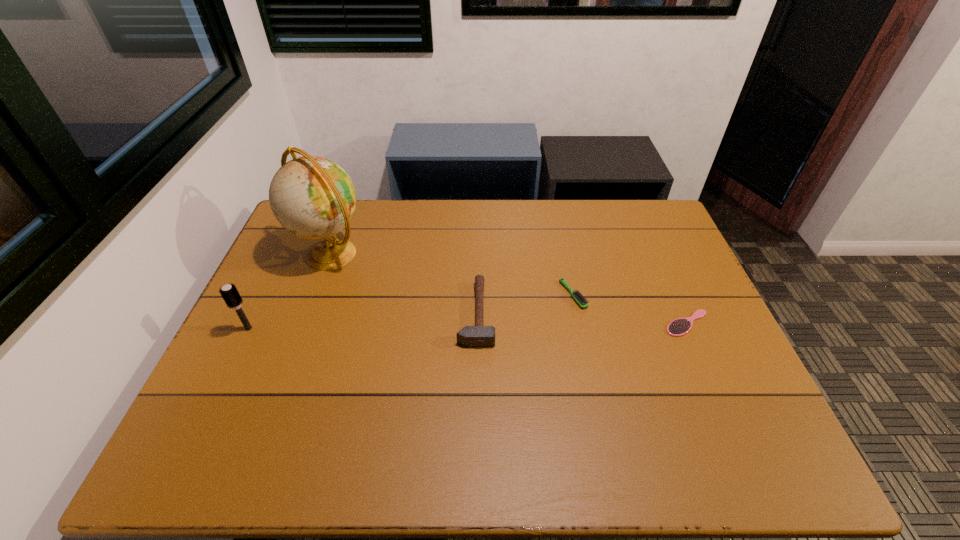
The image size is (960, 540). Find the location of `vacant position in the image that satisfies the following two spatial constraints: 1. on the striking surface of the third object from right to left; 2. on the right side of the rightmost hairbrush`. vacant position in the image that satisfies the following two spatial constraints: 1. on the striking surface of the third object from right to left; 2. on the right side of the rightmost hairbrush is located at coordinates (476, 323).

Identify the location of free location that satisfies the following two spatial constraints: 1. on the back side of the leftmost hairbrush; 2. on the right side of the second shortest hairbrush. The image size is (960, 540). (265, 295).